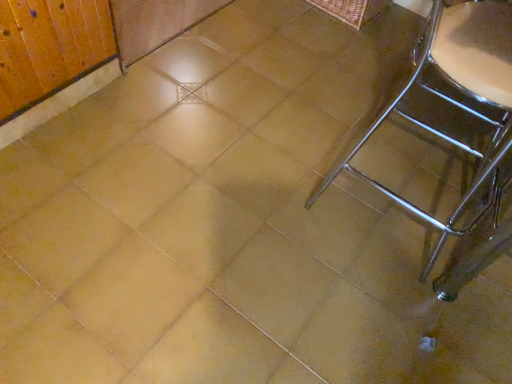
Question: Does woven brown basket at upper right appear on the left side of polished chrome chair at right?

Choices:
 (A) no
 (B) yes

Answer: (B)

Question: Can you confirm if woven brown basket at upper right is shorter than polished chrome chair at right?

Choices:
 (A) yes
 (B) no

Answer: (A)

Question: Is woven brown basket at upper right positioned beyond the bounds of polished chrome chair at right?

Choices:
 (A) yes
 (B) no

Answer: (A)

Question: Is the depth of woven brown basket at upper right greater than that of polished chrome chair at right?

Choices:
 (A) yes
 (B) no

Answer: (A)

Question: From the image's perspective, does woven brown basket at upper right appear lower than polished chrome chair at right?

Choices:
 (A) no
 (B) yes

Answer: (A)

Question: Is woven brown basket at upper right directly adjacent to polished chrome chair at right?

Choices:
 (A) no
 (B) yes

Answer: (A)

Question: Would you say polished chrome chair at right is a long distance from woven brown basket at upper right?

Choices:
 (A) no
 (B) yes

Answer: (A)

Question: Is polished chrome chair at right taller than woven brown basket at upper right?

Choices:
 (A) no
 (B) yes

Answer: (B)

Question: Does polished chrome chair at right come behind woven brown basket at upper right?

Choices:
 (A) no
 (B) yes

Answer: (A)

Question: From a real-world perspective, is polished chrome chair at right physically above woven brown basket at upper right?

Choices:
 (A) no
 (B) yes

Answer: (B)

Question: Is polished chrome chair at right positioned with its back to woven brown basket at upper right?

Choices:
 (A) no
 (B) yes

Answer: (A)

Question: From the image's perspective, does polished chrome chair at right appear lower than woven brown basket at upper right?

Choices:
 (A) no
 (B) yes

Answer: (B)

Question: In terms of height, does polished chrome chair at right look taller or shorter compared to woven brown basket at upper right?

Choices:
 (A) tall
 (B) short

Answer: (A)